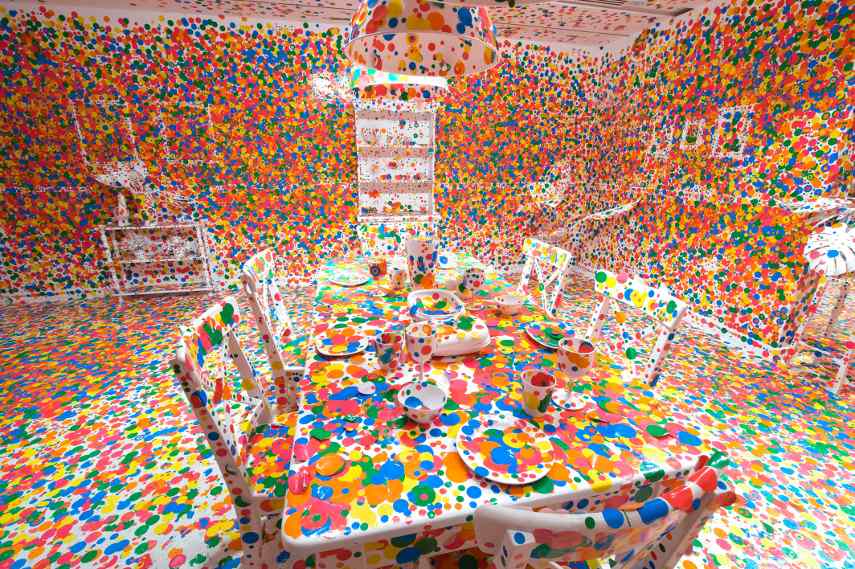
At what (x,y) coordinates should I click in order to perform the action: click on chair. Please return your answer as a coordinate pair (x, y). The width and height of the screenshot is (855, 569). Looking at the image, I should click on (652, 364).